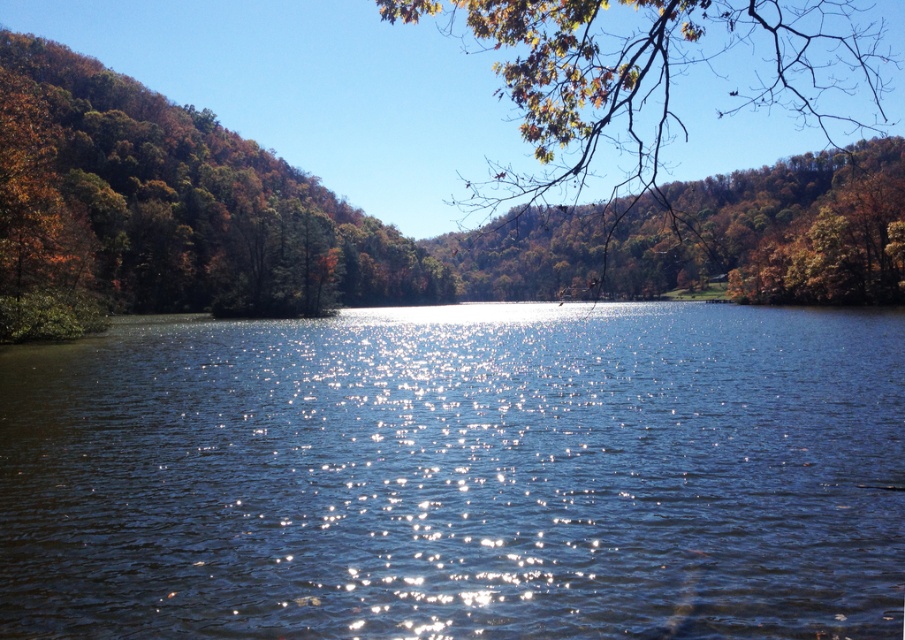
You are a bird flying over the lakeside scene. You see the blue liquid water at center and the brown leafy branch at upper right. Which object is closer to the ground?

The blue liquid water at center is shorter than the brown leafy branch at upper right, so the blue liquid water at center is closer to the ground.

You are standing at the lakeside and want to take a photo of both point (251, 602) and point (508, 179) in the scene. Which point should you focus on first to ensure both are in clear view?

You should focus on point (251, 602) first because it is closer to the camera than point (508, 179). By focusing on the closer point, the farther point will also be in focus due to the depth of field.

You are standing at the lakeside and want to locate the blue liquid water at center and the brown leafy branch at upper right. Which object is positioned more towards the left side of the scene?

The blue liquid water at center is positioned to the left of the brown leafy branch at upper right, so it is more towards the left side of the scene.